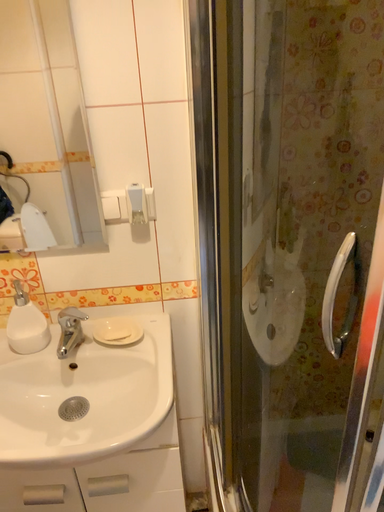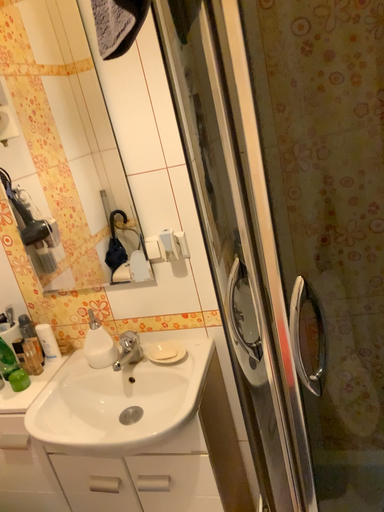
Question: How did the camera likely rotate when shooting the video?

Choices:
 (A) rotated right
 (B) rotated left

Answer: (B)